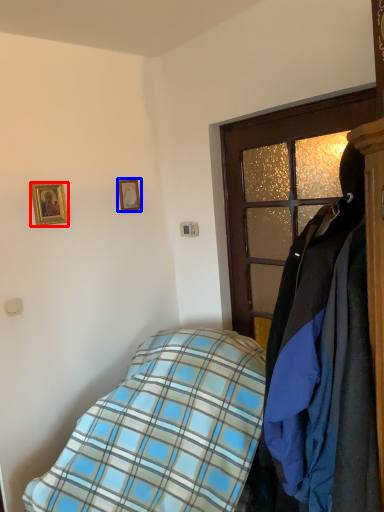
Question: Which of the following is the closest to the observer, picture frame (highlighted by a red box) or picture frame (highlighted by a blue box)?

Choices:
 (A) picture frame
 (B) picture frame

Answer: (A)